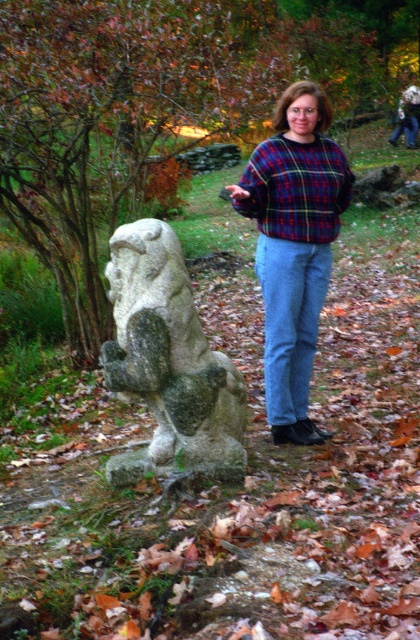
You are a photographer trying to capture a shot of the gray stone statue at center and the plaid sweater at center. From your current position, which object is located to the left?

The gray stone statue at center is positioned on the left side of plaid sweater at center, so the gray stone statue at center is to the left.

You are standing at point (275, 180) and want to walk to the stone sculpture in the foreground. Is the path to the sculpture blocked by any objects between your current position and point (136, 384)?

The path between point (275, 180) and point (136, 384) is not blocked because point (136, 384) is in front of point (275, 180), meaning there is a clear line of sight between them.